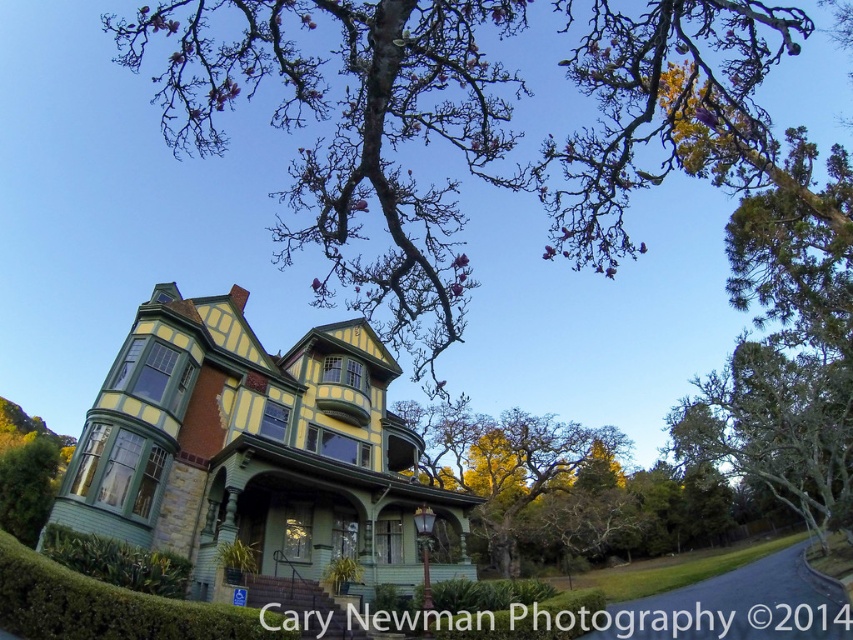
Question: Which of the following is the farthest from the observer?

Choices:
 (A) bare branches at upper center
 (B) green leafy tree at right

Answer: (B)

Question: Which of the following is the closest to the observer?

Choices:
 (A) bare branches at upper center
 (B) green leafy tree at right
 (C) green leafy tree at center

Answer: (A)

Question: Based on their relative distances, which object is farther from the green leafy tree at right?

Choices:
 (A) green leafy tree at center
 (B) bare branches at upper center

Answer: (B)

Question: Can you confirm if bare branches at upper center is positioned to the right of green leafy tree at center?

Choices:
 (A) yes
 (B) no

Answer: (B)

Question: Is green leafy tree at right to the right of green leafy tree at center from the viewer's perspective?

Choices:
 (A) yes
 (B) no

Answer: (A)

Question: Can you confirm if bare branches at upper center is positioned above green leafy tree at center?

Choices:
 (A) no
 (B) yes

Answer: (B)